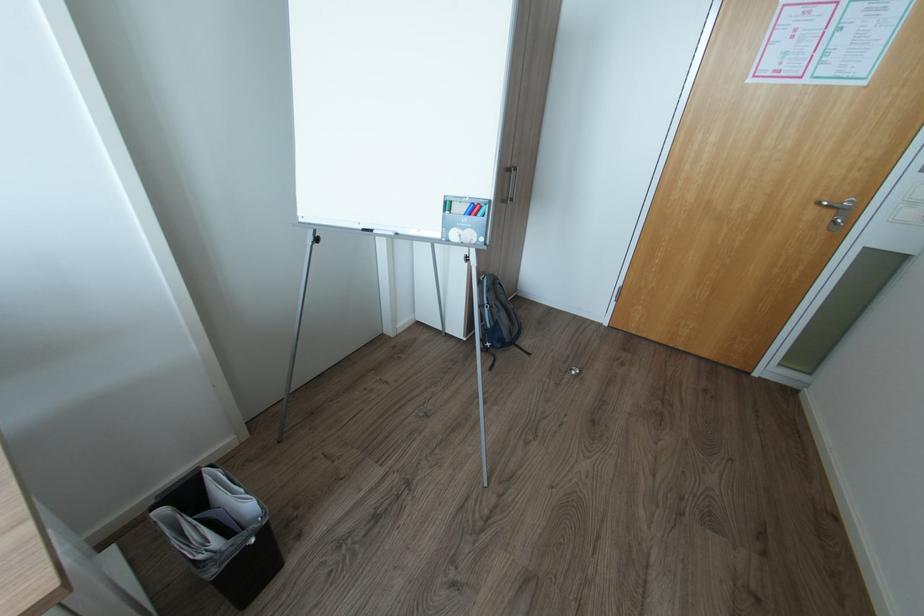
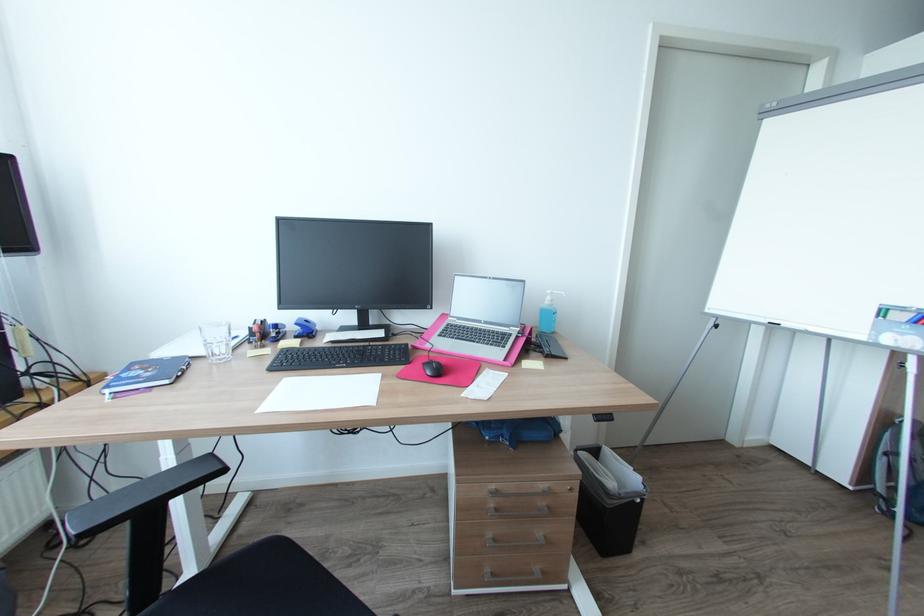
Find the pixel in the second image that matches (306,219) in the first image.

(712, 310)